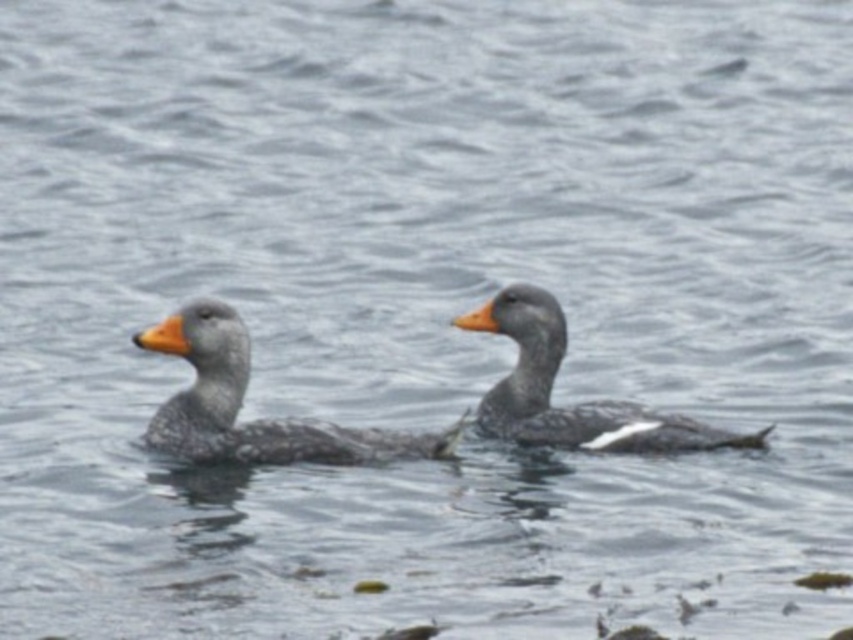
Question: Can you confirm if gray speckled duck at center is wider than gray matte duck at center?

Choices:
 (A) yes
 (B) no

Answer: (A)

Question: Does gray speckled duck at center come in front of gray matte duck at center?

Choices:
 (A) yes
 (B) no

Answer: (A)

Question: Among these points, which one is nearest to the camera?

Choices:
 (A) (631, 433)
 (B) (236, 376)

Answer: (B)

Question: Can you confirm if gray speckled duck at center is positioned to the left of gray matte duck at center?

Choices:
 (A) no
 (B) yes

Answer: (B)